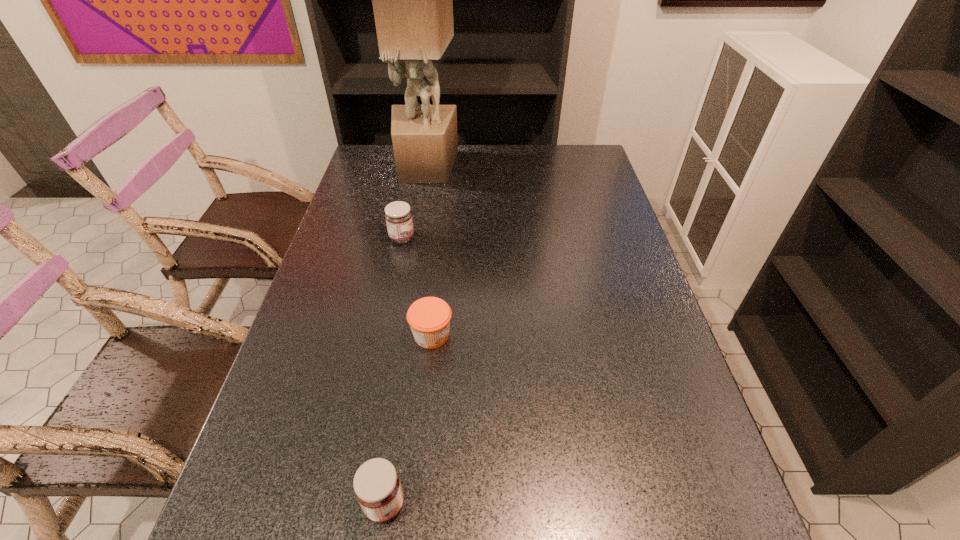
I want to click on unoccupied position between the farthest jam and the second farthest jam, so click(417, 287).

Where is `unoccupied area between the shortest object and the third nearest object`? The width and height of the screenshot is (960, 540). unoccupied area between the shortest object and the third nearest object is located at coordinates (417, 287).

Locate an element on the screen. The width and height of the screenshot is (960, 540). free space between the second farthest object and the sculpture is located at coordinates (414, 202).

Locate an element on the screen. The height and width of the screenshot is (540, 960). free space between the tallest object and the second nearest jam is located at coordinates click(x=428, y=251).

Where is `vacant point located between the nearest object and the second nearest object`? This screenshot has height=540, width=960. vacant point located between the nearest object and the second nearest object is located at coordinates (408, 419).

This screenshot has width=960, height=540. Find the location of `vacant point located between the farthest object and the nearest object`. vacant point located between the farthest object and the nearest object is located at coordinates (405, 335).

Find the location of a particular element. The width and height of the screenshot is (960, 540). vacant area that lies between the farthest jam and the nearest object is located at coordinates (394, 371).

Select which object is the closest to the nearest object. Please provide its 2D coordinates. Your answer should be formatted as a tuple, i.e. [(x, y)], where the tuple contains the x and y coordinates of a point satisfying the conditions above.

[(429, 318)]

At what (x,y) coordinates should I click in order to perform the action: click on object that stands as the closest to the nearest object. Please return your answer as a coordinate pair (x, y). Looking at the image, I should click on (429, 318).

Locate an element on the screen. This screenshot has height=540, width=960. jam that is the second closest to the nearest jam is located at coordinates (398, 216).